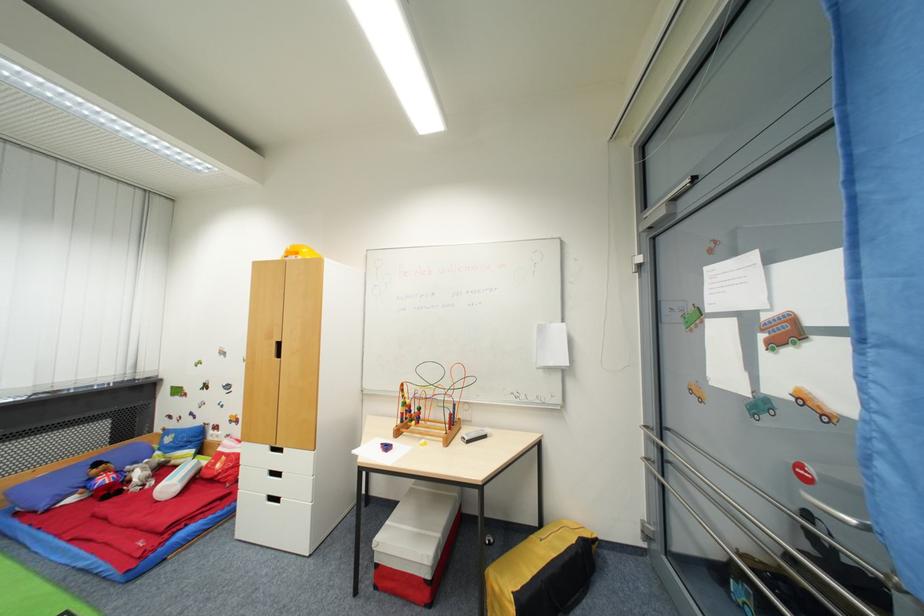
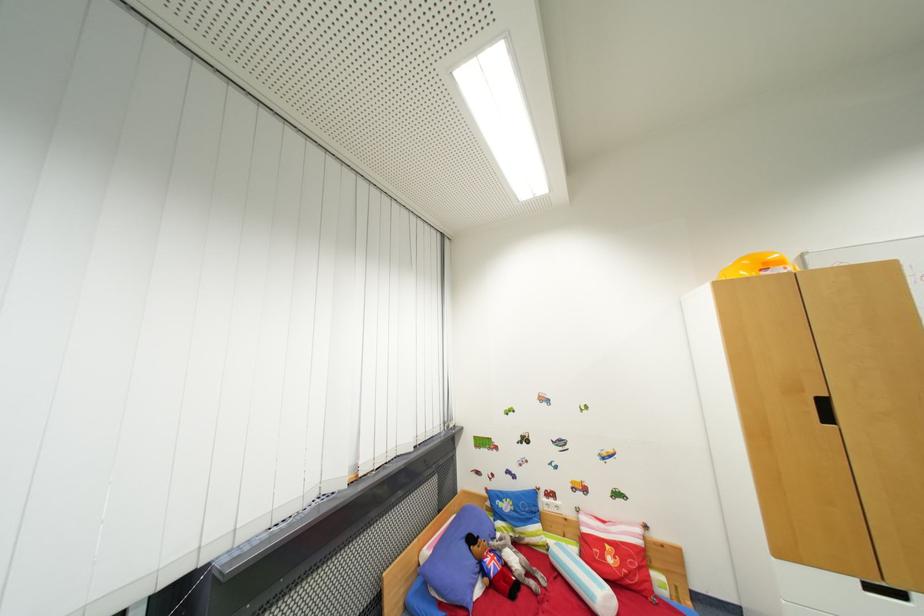
Locate, in the second image, the point that corresponds to [224,468] in the first image.

(614, 562)